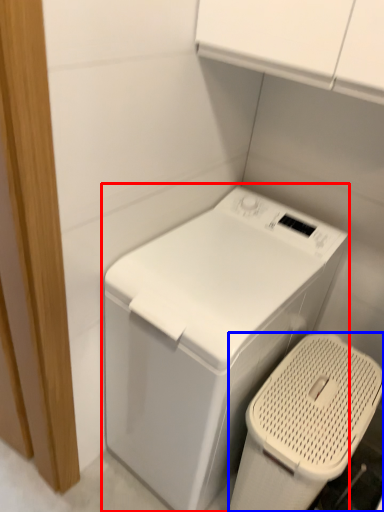
Question: Among these objects, which one is nearest to the camera, washing machine (highlighted by a red box) or appliance (highlighted by a blue box)?

Choices:
 (A) washing machine
 (B) appliance

Answer: (A)